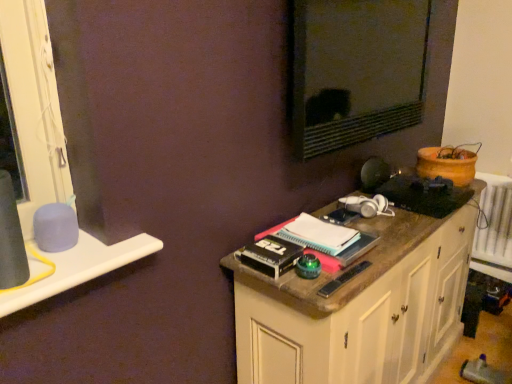
Question: From the image's perspective, is wooden cabinet at right located beneath matte black mirror at upper center?

Choices:
 (A) no
 (B) yes

Answer: (B)

Question: Is wooden cabinet at right outside of matte black mirror at upper center?

Choices:
 (A) yes
 (B) no

Answer: (A)

Question: Is wooden cabinet at right facing away from matte black mirror at upper center?

Choices:
 (A) no
 (B) yes

Answer: (A)

Question: Is wooden cabinet at right far away from matte black mirror at upper center?

Choices:
 (A) yes
 (B) no

Answer: (B)

Question: From the image's perspective, is wooden cabinet at right over matte black mirror at upper center?

Choices:
 (A) yes
 (B) no

Answer: (B)

Question: From a real-world perspective, does wooden cabinet at right stand above matte black mirror at upper center?

Choices:
 (A) no
 (B) yes

Answer: (A)

Question: Is white plastic window sill at left positioned with its back to wooden cabinet at right?

Choices:
 (A) no
 (B) yes

Answer: (A)

Question: Can you confirm if white plastic window sill at left is positioned to the right of wooden cabinet at right?

Choices:
 (A) yes
 (B) no

Answer: (B)

Question: Is wooden cabinet at right a part of white plastic window sill at left?

Choices:
 (A) yes
 (B) no

Answer: (B)

Question: Considering the relative sizes of white plastic window sill at left and wooden cabinet at right in the image provided, is white plastic window sill at left taller than wooden cabinet at right?

Choices:
 (A) no
 (B) yes

Answer: (A)

Question: Does white plastic window sill at left have a lesser width compared to wooden cabinet at right?

Choices:
 (A) no
 (B) yes

Answer: (B)

Question: Considering the relative positions of white plastic window sill at left and wooden cabinet at right in the image provided, is white plastic window sill at left behind wooden cabinet at right?

Choices:
 (A) no
 (B) yes

Answer: (A)

Question: From a real-world perspective, does matte black mirror at upper center stand above white plastic window sill at left?

Choices:
 (A) yes
 (B) no

Answer: (A)